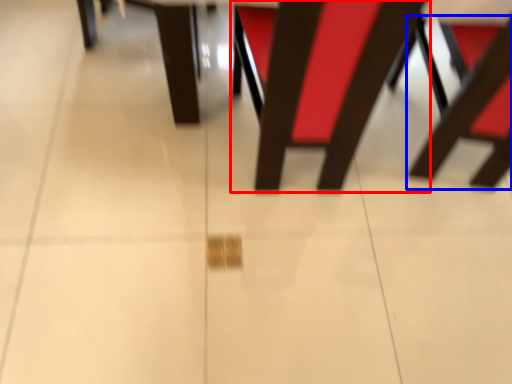
Question: Which of the following is the farthest to the observer, chair (highlighted by a red box) or chair (highlighted by a blue box)?

Choices:
 (A) chair
 (B) chair

Answer: (B)